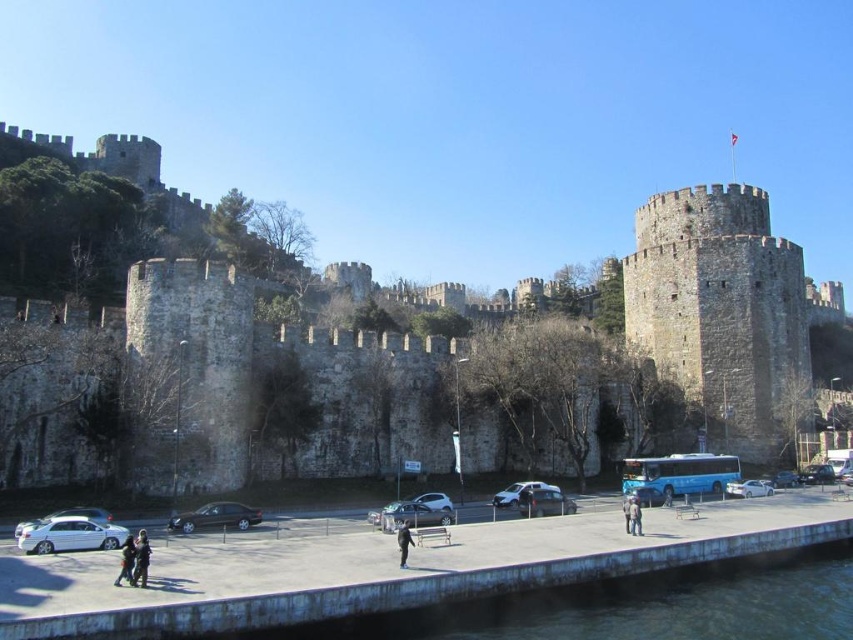
Is point (761, 490) behind point (421, 502)?

Yes, point (761, 490) is farther from viewer.

In the scene shown: Who is more distant from viewer, (766,483) or (444,502)?

Positioned behind is point (766,483).

Locate an element on the screen. This screenshot has width=853, height=640. white matte car at lower center is located at coordinates (747, 488).

Is metallic silver car at lower center thinner than dark blue jeans at lower center?

No, metallic silver car at lower center is not thinner than dark blue jeans at lower center.

Who is positioned more to the left, metallic silver car at lower center or dark blue jeans at lower center?

dark blue jeans at lower center is more to the left.

Who is more distant from viewer, (634,486) or (636,516)?

The point (634,486) is more distant.

In order to click on metallic silver car at lower center in this screenshot , I will do `click(646, 496)`.

Is point (560, 508) less distant than point (419, 496)?

Yes.

You are a GUI agent. You are given a task and a screenshot of the screen. Output one action in this format:
    pyautogui.click(x=<x>, y=<y>)
    Task: Click on the matte black car at center
    
    Given the screenshot: What is the action you would take?
    pyautogui.click(x=543, y=502)